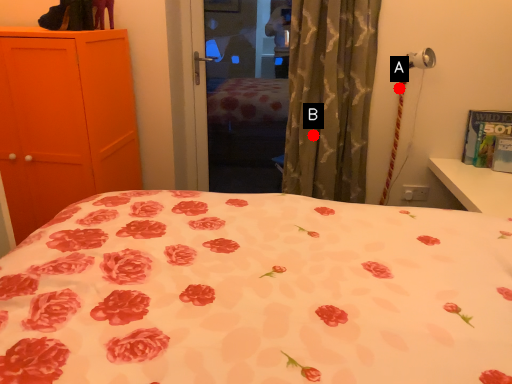
Question: Two points are circled on the image, labeled by A and B beside each circle. Which point appears farthest from the camera in this image?

Choices:
 (A) A is further
 (B) B is further

Answer: (A)